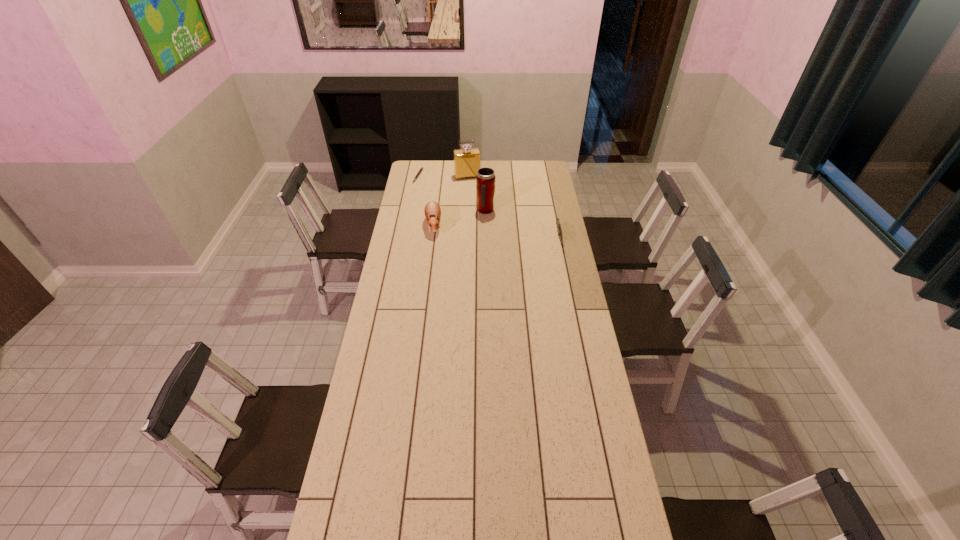
Locate an element on the screen. object that can be found as the closest to the third shortest object is located at coordinates (485, 179).

Select which object is the second closest to the perfume. Please provide its 2D coordinates. Your answer should be formatted as a tuple, i.e. [(x, y)], where the tuple contains the x and y coordinates of a point satisfying the conditions above.

[(485, 179)]

I want to click on free location that satisfies the following two spatial constraints: 1. on the front side of the thermos bottle; 2. on the right side of the shortest object, so click(x=412, y=211).

The height and width of the screenshot is (540, 960). Identify the location of free location that satisfies the following two spatial constraints: 1. on the front side of the perfume; 2. on the right side of the pen. click(x=418, y=177).